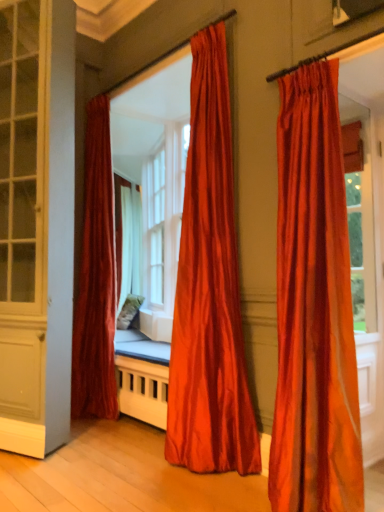
Find the location of a particular element. free space to the right of matte white screen door at left is located at coordinates (99, 451).